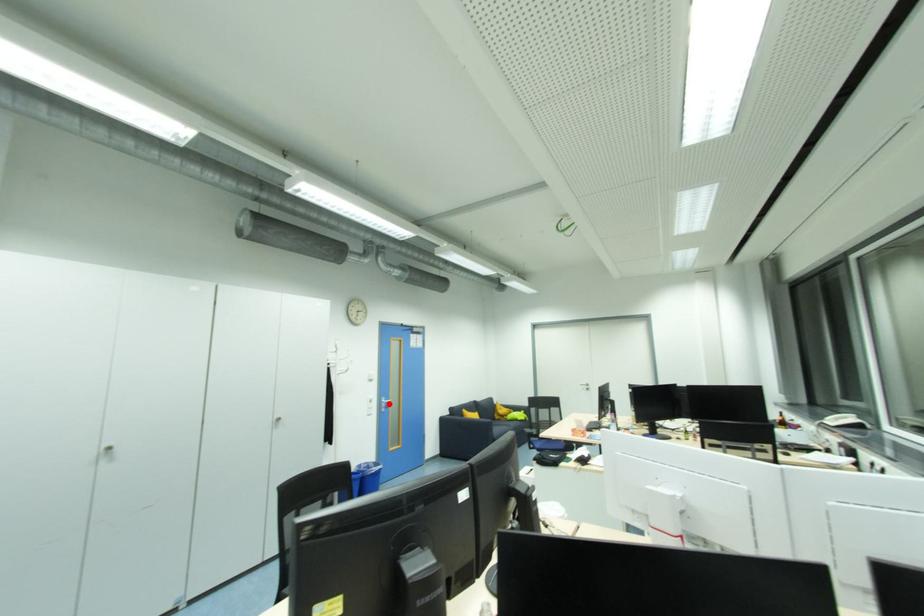
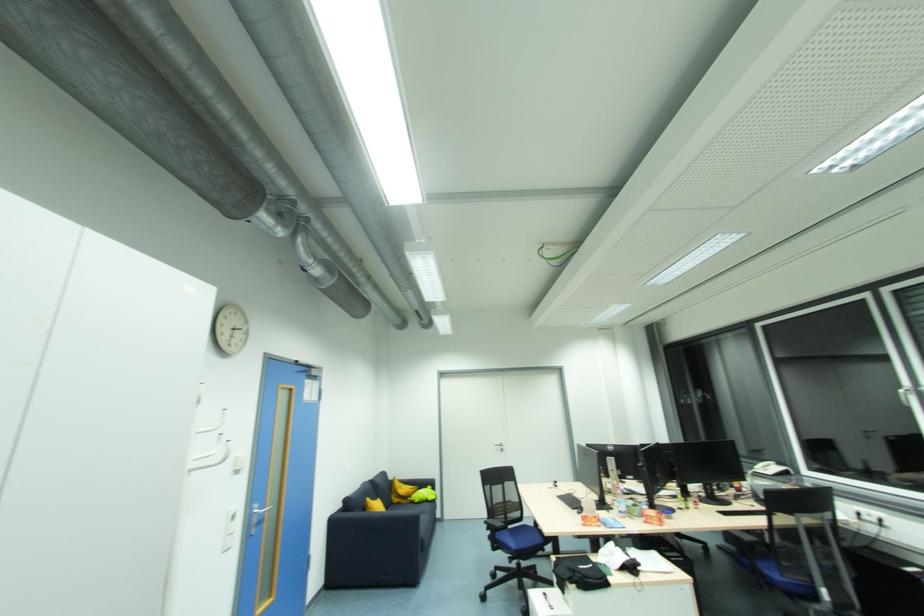
Locate, in the second image, the point that corresponds to the highlighted location in the first image.

(261, 517)